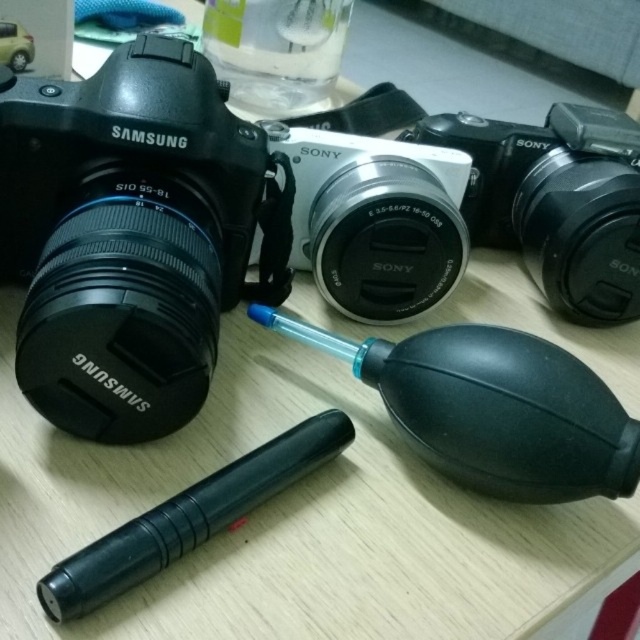
Question: Among these points, which one is farthest from the camera?

Choices:
 (A) (305, 464)
 (B) (627, 268)

Answer: (B)

Question: Estimate the real-world distances between objects in this image. Which object is closer to the black plastic camera at center?

Choices:
 (A) matte black camera at left
 (B) silver metallic camera at center

Answer: (B)

Question: Is matte black camera at left below black rubber pen at lower left?

Choices:
 (A) no
 (B) yes

Answer: (A)

Question: Which point is closer to the camera taking this photo?

Choices:
 (A) (147, 540)
 (B) (72, 301)
 (C) (628, 288)
 (D) (312, 269)

Answer: (A)

Question: From the image, what is the correct spatial relationship of silver metallic camera at center in relation to black rubber pen at lower left?

Choices:
 (A) above
 (B) below

Answer: (A)

Question: Is matte black camera at left smaller than silver metallic camera at center?

Choices:
 (A) yes
 (B) no

Answer: (B)